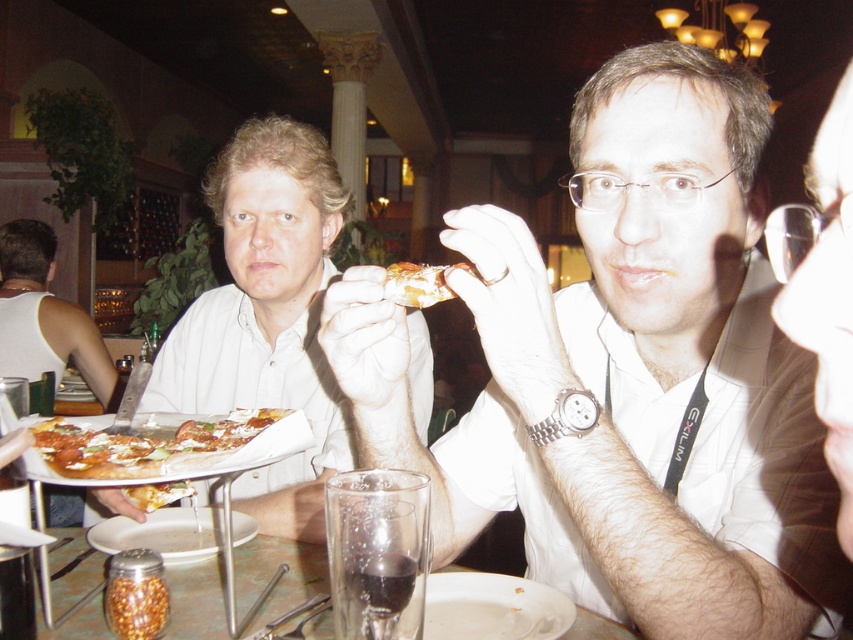
Question: Is cheesy pizza at center closer to camera compared to white glossy plate at lower center?

Choices:
 (A) yes
 (B) no

Answer: (A)

Question: Which object appears farthest from the camera in this image?

Choices:
 (A) matte white shirt at left
 (B) clear glass at lower center

Answer: (A)

Question: From the image, what is the correct spatial relationship of clear glass at lower center in relation to golden crispy pizza slice at center?

Choices:
 (A) above
 (B) below

Answer: (B)

Question: Is matte white shirt at center positioned before white matte shirt at upper left?

Choices:
 (A) yes
 (B) no

Answer: (A)

Question: Which of these objects is positioned closest to the golden crispy pizza slice at center?

Choices:
 (A) matte white shirt at left
 (B) cheesy pizza at center

Answer: (B)

Question: Among these points, which one is farthest from the camera?

Choices:
 (A) (80, 310)
 (B) (119, 452)

Answer: (A)